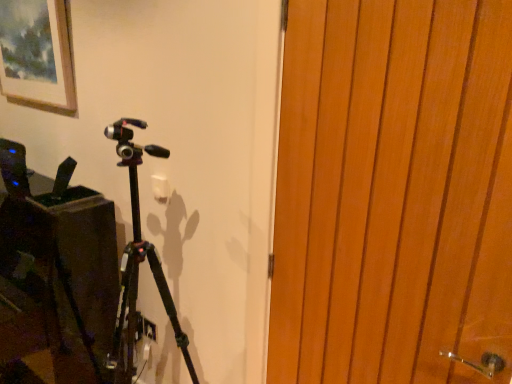
Question: Are wooden door at right and black matte tripod at center beside each other?

Choices:
 (A) no
 (B) yes

Answer: (A)

Question: From the image's perspective, is wooden door at right on top of black matte tripod at center?

Choices:
 (A) no
 (B) yes

Answer: (B)

Question: From the image's perspective, would you say wooden door at right is shown under black matte tripod at center?

Choices:
 (A) no
 (B) yes

Answer: (A)

Question: From a real-world perspective, is wooden door at right over black matte tripod at center?

Choices:
 (A) no
 (B) yes

Answer: (B)

Question: From a real-world perspective, is wooden door at right physically below black matte tripod at center?

Choices:
 (A) yes
 (B) no

Answer: (B)

Question: From their relative heights in the image, would you say wooden door at right is taller or shorter than black matte tripod at center?

Choices:
 (A) short
 (B) tall

Answer: (A)

Question: Is point [445, 215] positioned closer to the camera than point [238, 286]?

Choices:
 (A) closer
 (B) farther

Answer: (A)

Question: Looking at their shapes, would you say wooden door at right is wider or thinner than black matte tripod at center?

Choices:
 (A) thin
 (B) wide

Answer: (A)

Question: Based on their positions, is wooden door at right located to the left or right of black matte tripod at center?

Choices:
 (A) left
 (B) right

Answer: (B)

Question: Considering their positions, is wooden door at right located in front of or behind matte wooden picture frame at upper left?

Choices:
 (A) front
 (B) behind

Answer: (A)

Question: From their relative heights in the image, would you say wooden door at right is taller or shorter than matte wooden picture frame at upper left?

Choices:
 (A) tall
 (B) short

Answer: (A)

Question: Considering the relative positions of wooden door at right and matte wooden picture frame at upper left in the image provided, is wooden door at right to the left or to the right of matte wooden picture frame at upper left?

Choices:
 (A) left
 (B) right

Answer: (B)

Question: In terms of size, does wooden door at right appear bigger or smaller than matte wooden picture frame at upper left?

Choices:
 (A) small
 (B) big

Answer: (B)

Question: From a real-world perspective, is black matte tripod at center above or below matte wooden picture frame at upper left?

Choices:
 (A) below
 (B) above

Answer: (A)

Question: Visually, is black matte tripod at center positioned to the left or to the right of matte wooden picture frame at upper left?

Choices:
 (A) right
 (B) left

Answer: (A)